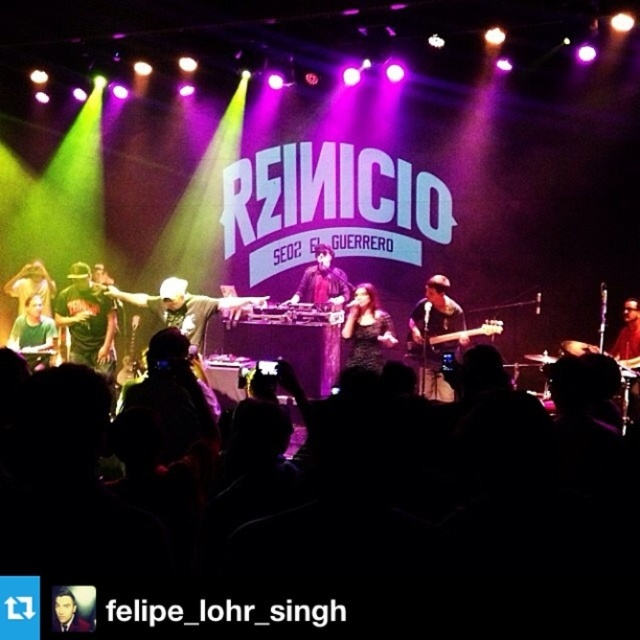
You are a photographer at the concert venue and want to capture a closeup of the green matte shirt at left. You are currently standing at point (33, 333). Which direction should you move to get a better shot?

A: The green matte shirt at left is located at point (33, 333), so you are already at the correct position to capture the closeup.

You are a photographer at the concert venue and want to capture a photo of the dark green shirt at center. Where should you aim your camera?

The dark green shirt at center is located at point 0.502 on the x and 0.136 on the y axis, so aim your camera there.

You are a stagehand who needs to move a heavy equipment from point A to point B. The coordinates for point A are point (x=84, y=268) and point B are point (x=26, y=342). According to the stage layout, which direction should you move the equipment to go from point A to point B?

Point (x=84, y=268) is behind point (x=26, y=342), so to move from point A to point B, you should move forward towards the front of the stage.